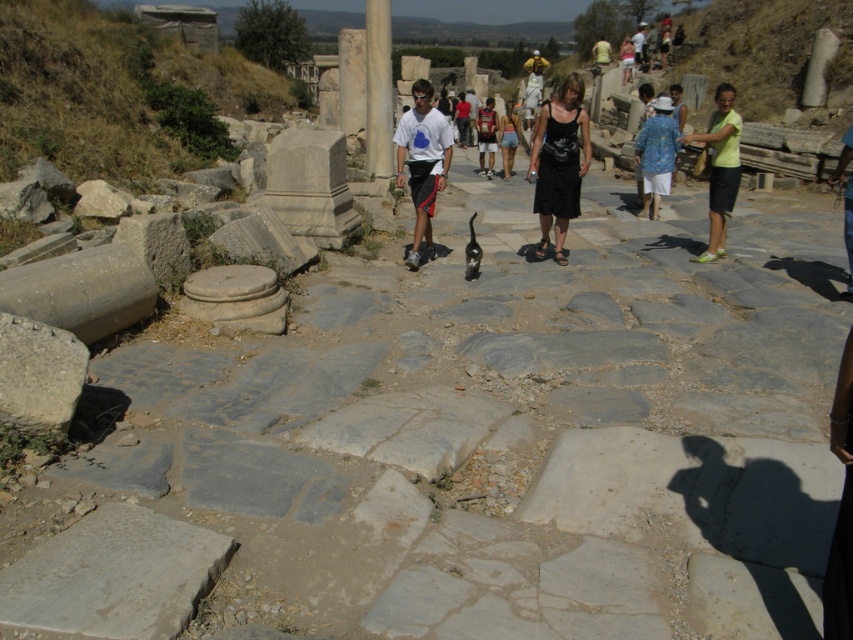
You are a tour guide leading a group at the archaeological site. You notice two visitors wearing a black cotton dress at center and a light green fabric shirt at right. Which visitor is standing more to the left side of the path?

The black cotton dress at center is positioned on the left side of the light green fabric shirt at right, so the visitor in the black cotton dress at center is standing more to the left side of the path.

You are a tour guide at the archaeological site. You notice two visitors wearing a black cotton dress at center and a light green fabric shirt at right. From your current position, which visitor is standing closer to the ground?

The black cotton dress at center is located below light green fabric shirt at right, so the visitor wearing the black cotton dress at center is standing closer to the ground.